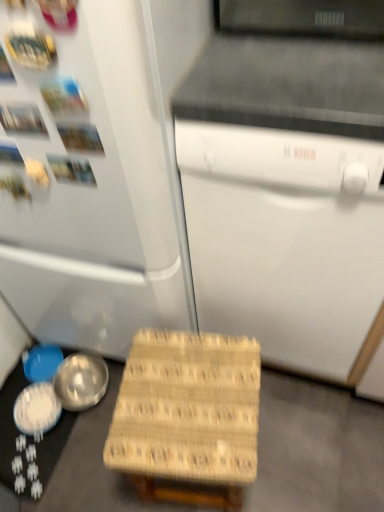
The width and height of the screenshot is (384, 512). Identify the location of empty space that is ontop of woven wood step stool at lower center. (190, 399).